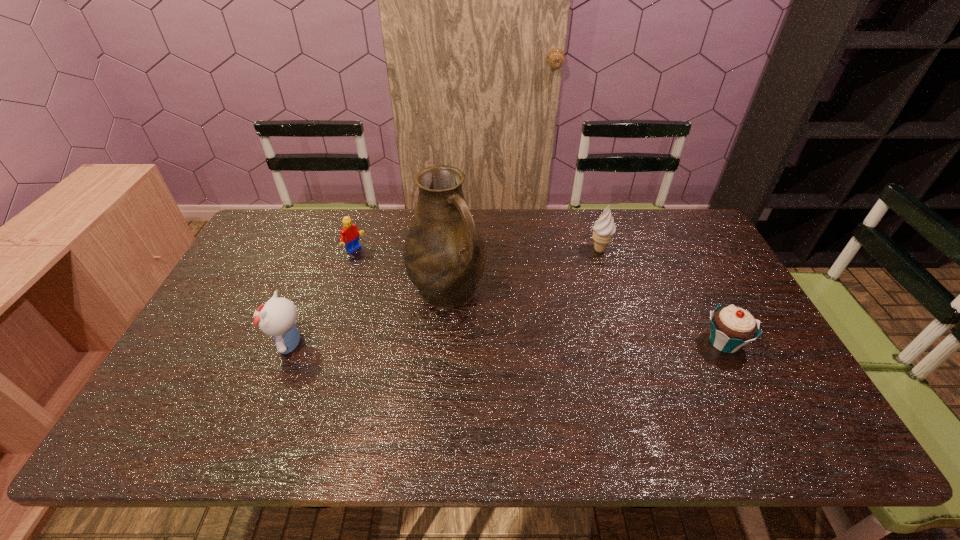
Find the location of a particular element. The width and height of the screenshot is (960, 540). free space between the cupcake and the third farthest object is located at coordinates (586, 316).

At what (x,y) coordinates should I click in order to perform the action: click on free point between the kitten and the Lego. Please return your answer as a coordinate pair (x, y). Looking at the image, I should click on (323, 298).

This screenshot has height=540, width=960. I want to click on vacant space that's between the icecream and the cupcake, so click(x=661, y=296).

The image size is (960, 540). I want to click on free space that is in between the tallest object and the cupcake, so click(586, 316).

Where is `unoccupied position between the fourth object from right to left and the kitten`? The height and width of the screenshot is (540, 960). unoccupied position between the fourth object from right to left and the kitten is located at coordinates (323, 298).

Locate an element on the screen. This screenshot has width=960, height=540. vacant point located between the second object from right to left and the rightmost object is located at coordinates (661, 296).

Where is `vacant area that lies between the Lego and the cupcake`? The width and height of the screenshot is (960, 540). vacant area that lies between the Lego and the cupcake is located at coordinates (540, 297).

At what (x,y) coordinates should I click in order to perform the action: click on free space between the cupcake and the pitcher. Please return your answer as a coordinate pair (x, y). Looking at the image, I should click on (586, 316).

Identify which object is the fourth nearest to the second object from right to left. Please provide its 2D coordinates. Your answer should be formatted as a tuple, i.e. [(x, y)], where the tuple contains the x and y coordinates of a point satisfying the conditions above.

[(277, 318)]

Locate which object ranks second in proximity to the leftmost object. Please provide its 2D coordinates. Your answer should be formatted as a tuple, i.e. [(x, y)], where the tuple contains the x and y coordinates of a point satisfying the conditions above.

[(349, 236)]